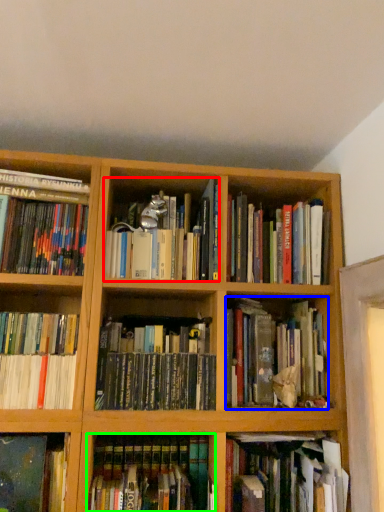
Question: Which is nearer to the book (highlighted by a red box)? book (highlighted by a blue box) or book (highlighted by a green box).

Choices:
 (A) book
 (B) book

Answer: (A)